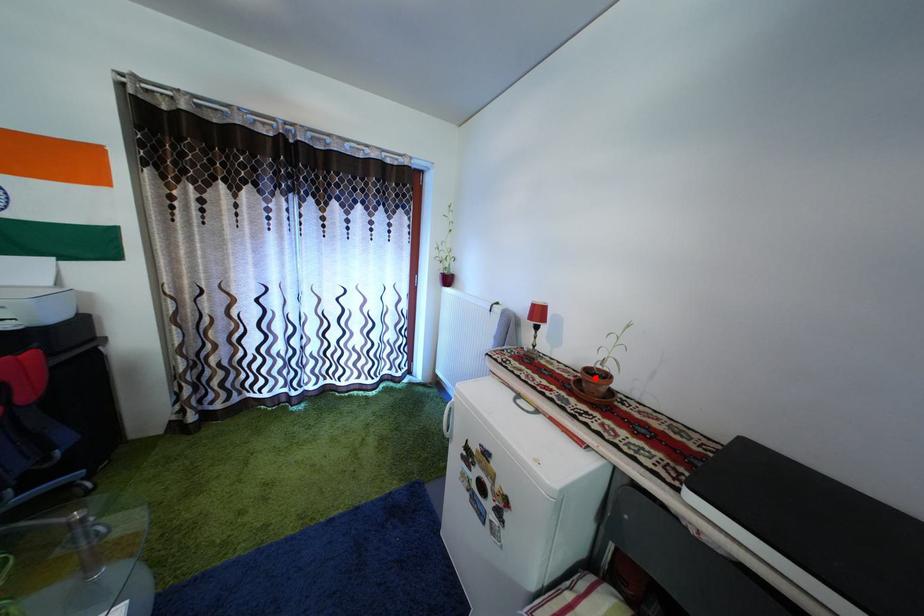
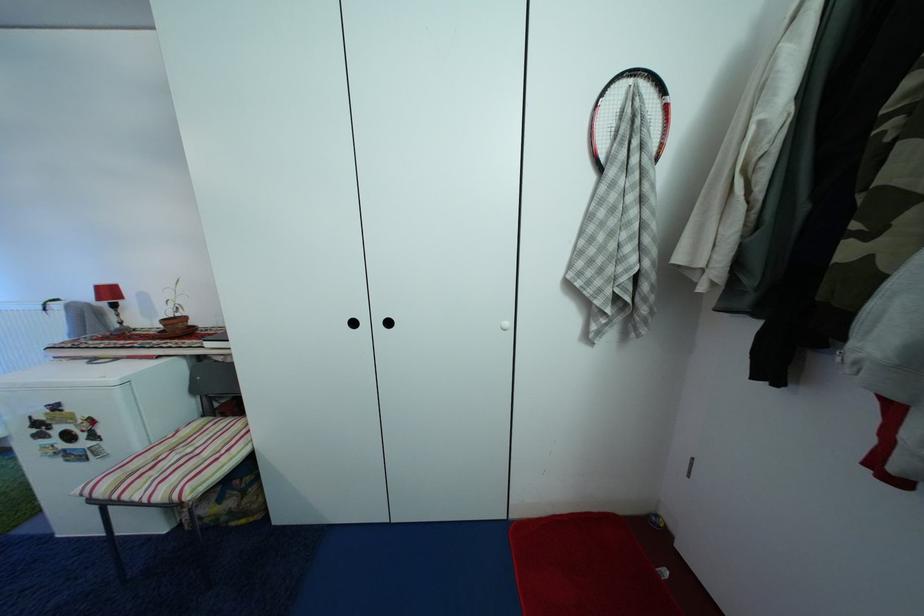
In the second image, find the point that corresponds to the highlighted location in the first image.

(174, 326)